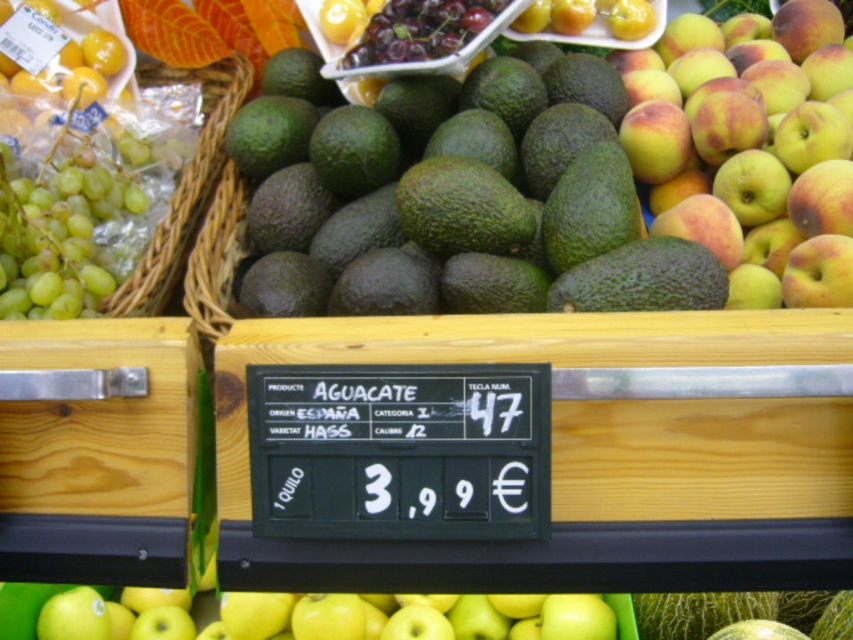
Question: Considering the relative positions of green matte avocado at center and yellow matte apple at center in the image provided, where is green matte avocado at center located with respect to yellow matte apple at center?

Choices:
 (A) right
 (B) left

Answer: (B)

Question: Does green matte avocado at center appear on the right side of green matte grapes at left?

Choices:
 (A) yes
 (B) no

Answer: (A)

Question: Which point is farther from the camera taking this photo?

Choices:
 (A) (200, 202)
 (B) (671, 308)
 (C) (9, 314)

Answer: (A)

Question: Among these objects, which one is farthest from the camera?

Choices:
 (A) green woven basket at left
 (B) yellow matte apple at center

Answer: (A)

Question: Based on their relative distances, which object is farther from the green matte grapes at left?

Choices:
 (A) yellow matte apple at center
 (B) green matte avocado at center
 (C) green woven basket at left

Answer: (A)

Question: In this image, where is green matte avocado at center located relative to green matte grapes at left?

Choices:
 (A) below
 (B) above

Answer: (B)